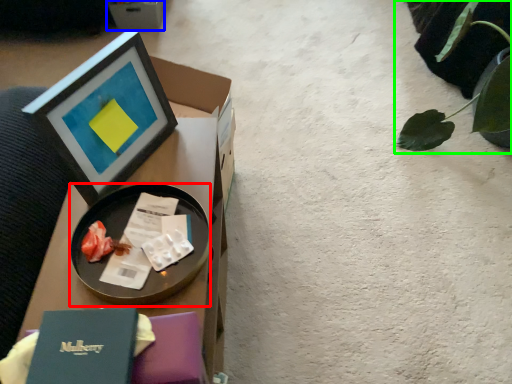
Question: Estimate the real-world distances between objects in this image. Which object is farther from tableware (highlighted by a red box), cardboard box (highlighted by a blue box) or plant (highlighted by a green box)?

Choices:
 (A) cardboard box
 (B) plant

Answer: (A)